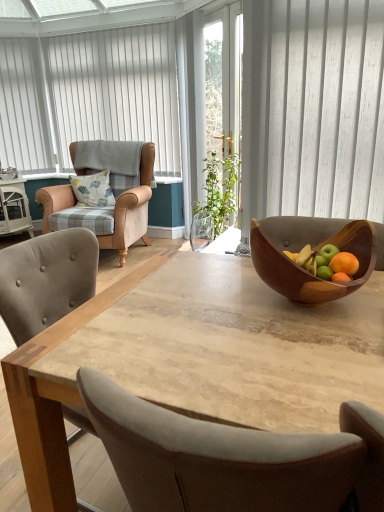
Question: Is beige leather armchair at left at the left side of white vertical blinds at upper left?

Choices:
 (A) yes
 (B) no

Answer: (B)

Question: Is the position of beige leather armchair at left more distant than that of white vertical blinds at upper left?

Choices:
 (A) yes
 (B) no

Answer: (B)

Question: From the image's perspective, is beige leather armchair at left beneath white vertical blinds at upper left?

Choices:
 (A) yes
 (B) no

Answer: (A)

Question: Does beige leather armchair at left have a lesser width compared to white vertical blinds at upper left?

Choices:
 (A) no
 (B) yes

Answer: (A)

Question: Is beige leather armchair at left oriented away from white vertical blinds at upper left?

Choices:
 (A) yes
 (B) no

Answer: (B)

Question: Considering the relative sizes of beige leather armchair at left and white vertical blinds at upper left in the image provided, is beige leather armchair at left wider than white vertical blinds at upper left?

Choices:
 (A) yes
 (B) no

Answer: (A)

Question: Does natural wood table at center appear on the right side of floral fabric pillow at left?

Choices:
 (A) no
 (B) yes

Answer: (B)

Question: Does natural wood table at center have a greater height compared to floral fabric pillow at left?

Choices:
 (A) yes
 (B) no

Answer: (A)

Question: Are natural wood table at center and floral fabric pillow at left far apart?

Choices:
 (A) yes
 (B) no

Answer: (A)

Question: Is natural wood table at center outside floral fabric pillow at left?

Choices:
 (A) yes
 (B) no

Answer: (A)

Question: Is floral fabric pillow at left at the back of natural wood table at center?

Choices:
 (A) no
 (B) yes

Answer: (A)

Question: Are natural wood table at center and floral fabric pillow at left beside each other?

Choices:
 (A) no
 (B) yes

Answer: (A)

Question: Is beige leather armchair at left located outside wooden bowl at center?

Choices:
 (A) no
 (B) yes

Answer: (B)